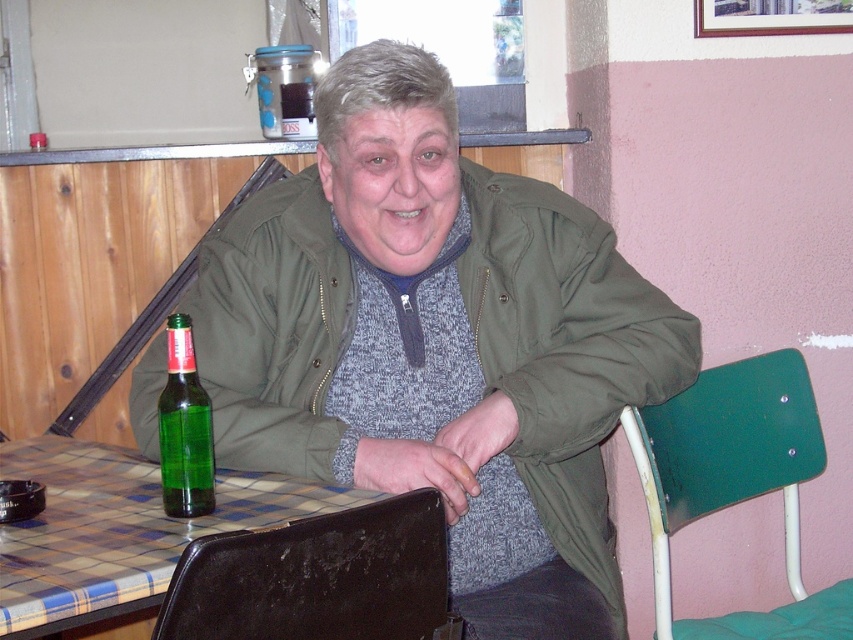
Question: Can you confirm if black leather chair at lower center is positioned to the left of plaid fabric table at lower left?

Choices:
 (A) no
 (B) yes

Answer: (A)

Question: Which object appears closest to the camera in this image?

Choices:
 (A) black leather chair at lower center
 (B) green plastic chair at lower right
 (C) green matte jacket at center
 (D) plaid fabric table at lower left

Answer: (A)

Question: Which object is the farthest from the black leather chair at lower center?

Choices:
 (A) plaid fabric table at lower left
 (B) green plastic chair at lower right
 (C) green glass bottle at lower left

Answer: (B)

Question: Does black leather chair at lower center appear under green glass bottle at lower left?

Choices:
 (A) yes
 (B) no

Answer: (A)

Question: Based on their relative distances, which object is nearer to the green plastic chair at lower right?

Choices:
 (A) green matte jacket at center
 (B) green glass bottle at lower left

Answer: (A)

Question: Is green plastic chair at lower right to the right of green glass bottle at lower left from the viewer's perspective?

Choices:
 (A) yes
 (B) no

Answer: (A)